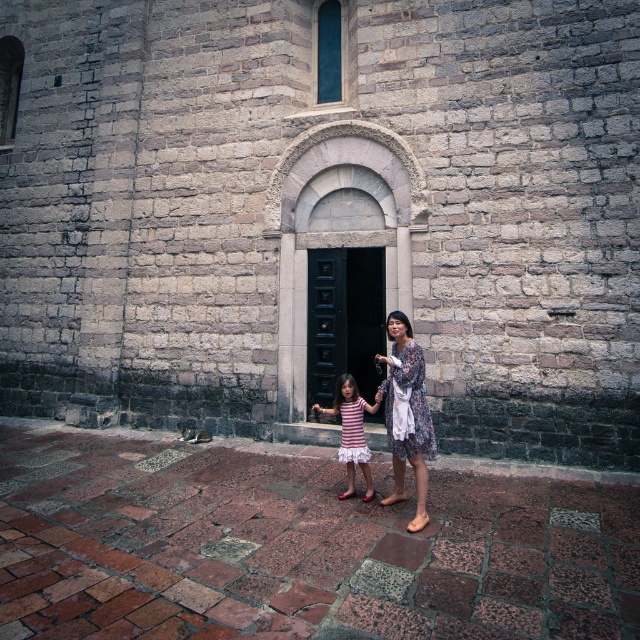
Looking at this image, does gray stone church at center come behind black wooden door at center?

No.

Which is more to the left, gray stone church at center or black wooden door at center?

gray stone church at center

You are a GUI agent. You are given a task and a screenshot of the screen. Output one action in this format:
    pyautogui.click(x=<x>, y=<y>)
    Task: Click on the gray stone church at center
    
    Given the screenshot: What is the action you would take?
    pyautogui.click(x=323, y=209)

Find the location of a particular element. This screenshot has height=640, width=640. gray stone church at center is located at coordinates (323, 209).

Is gray stone church at center closer to the viewer compared to floral dress at center?

That is False.

Does gray stone church at center have a lesser height compared to floral dress at center?

No.

Between point (563, 257) and point (420, 508), which one is positioned behind?

The point (563, 257) is behind.

Where is `gray stone church at center`? Image resolution: width=640 pixels, height=640 pixels. gray stone church at center is located at coordinates (323, 209).

At what (x,y) coordinates should I click in order to perform the action: click on gray stone church at center. Please return your answer as a coordinate pair (x, y). The height and width of the screenshot is (640, 640). Looking at the image, I should click on point(323,209).

Is gray stone church at center positioned behind striped fabric dress at center?

Yes, gray stone church at center is further from the viewer.

The image size is (640, 640). What do you see at coordinates (323, 209) in the screenshot?
I see `gray stone church at center` at bounding box center [323, 209].

Locate an element on the screen. gray stone church at center is located at coordinates (323, 209).